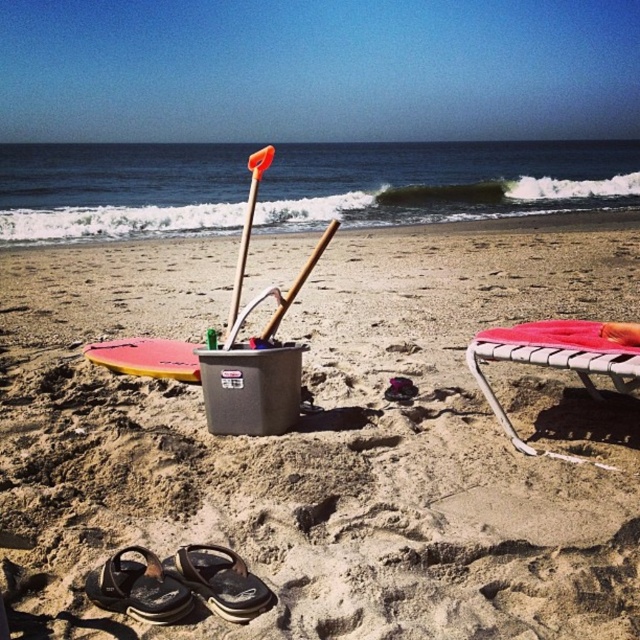
You are a child who wants to play with both the black rubber sandal at lower left and the wooden shovel at center. Which one can you pick up first if you reach for the one that takes up more space in the bucket?

The wooden shovel at center takes up more space in the bucket than the black rubber sandal at lower left, so you can pick up the wooden shovel at center first.

You are a beachgoer who wants to store your black rubber sandal at lower center and yellow matte surfboard at lower left in a storage bin. The bin has a width of 15 cm. Which item might not fit if placed sideways?

The yellow matte surfboard at lower left might not fit in the storage bin because it is wider than the black rubber sandal at lower center, and the bin is only 15 cm wide.